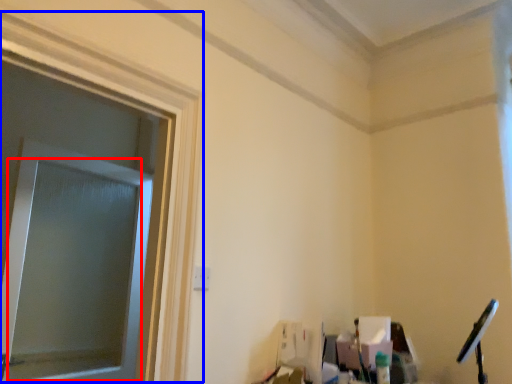
Question: Which object is further to the camera taking this photo, window screen (highlighted by a red box) or window frame (highlighted by a blue box)?

Choices:
 (A) window screen
 (B) window frame

Answer: (A)